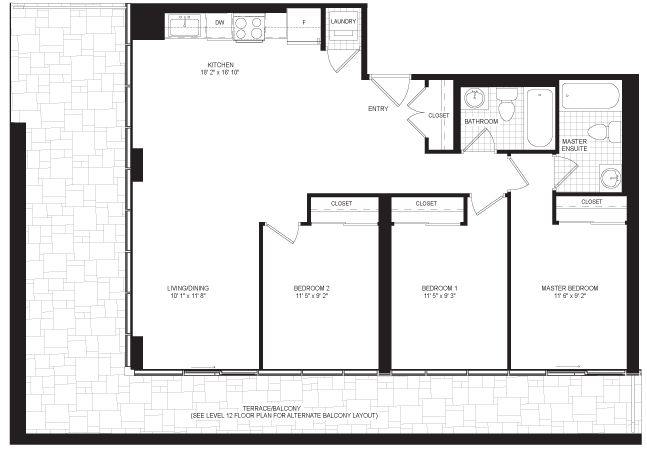
At what (x,y) coordinates should I click in order to perform the action: click on toilets. Please return your answer as a coordinate pair (x, y). Looking at the image, I should click on (507, 108), (597, 131).